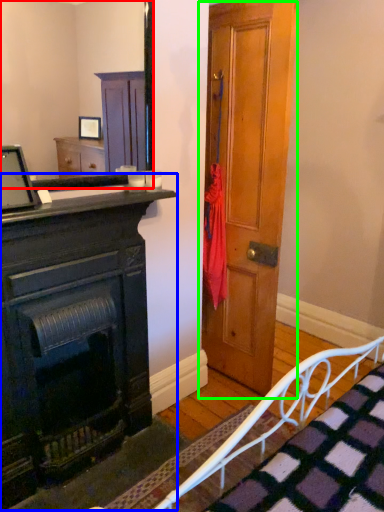
Question: Which is nearer to the mirror (highlighted by a red box)? chest of drawers (highlighted by a blue box) or door (highlighted by a green box).

Choices:
 (A) chest of drawers
 (B) door

Answer: (B)